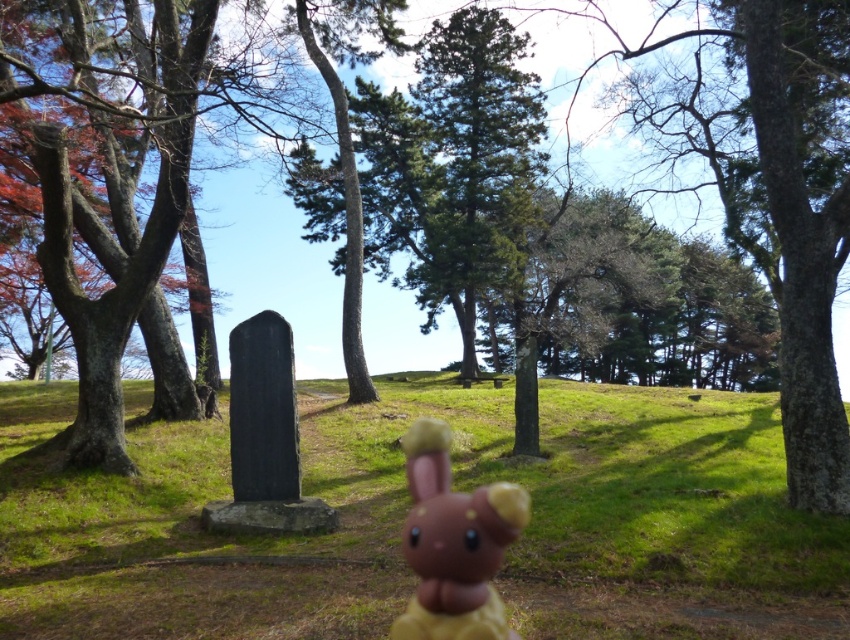
Between green grassy at center and brown matte plush toy at center, which one has more height?

green grassy at center

Can you confirm if green grassy at center is positioned below brown matte plush toy at center?

Yes.

Between point (213, 451) and point (437, 531), which one is positioned behind?

Positioned behind is point (213, 451).

At what (x,y) coordinates should I click in order to perform the action: click on green grassy at center. Please return your answer as a coordinate pair (x, y). This screenshot has height=640, width=850. Looking at the image, I should click on (404, 515).